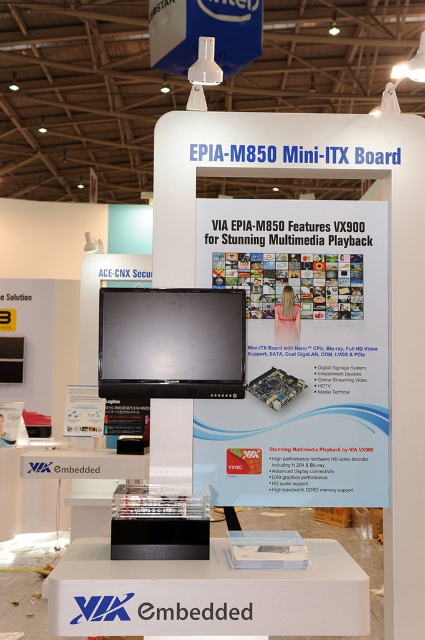
You are a trade show attendee standing at the entrance of the exhibition hall. You see the matte black monitor at center displaying the EPIA board. If you want to read the text on the monitor clearly, would you need to move closer or farther away?

The matte black monitor at center is 2.70 meters away from the viewer. To read the text clearly, you should move closer since the current distance may be too far for comfortable reading.

From the picture: You are setting up a trade show booth and need to place a new promotional banner that is 1.2 meters wide. The banner must be placed above the white glossy poster at center and the matte black monitor at center. Given their current sizes, will the banner fit if it needs to cover both objects entirely?

The white glossy poster at center is larger than the matte black monitor at center. Since the banner is 1.2 meters wide, it can cover both objects if their combined width is less than or equal to 1.2 meters. However, without knowing the exact dimensions of each object, we cannot definitively confirm if the banner will fit. Please measure the total width required to cover both objects before placing the banner.